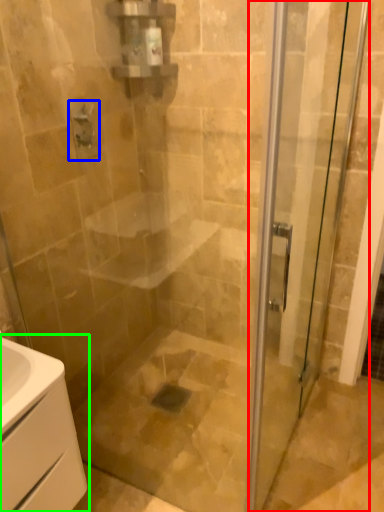
Question: Based on their relative distances, which object is farther from door (highlighted by a red box)? Choose from shower (highlighted by a blue box) and bathroom cabinet (highlighted by a green box).

Choices:
 (A) shower
 (B) bathroom cabinet

Answer: (A)